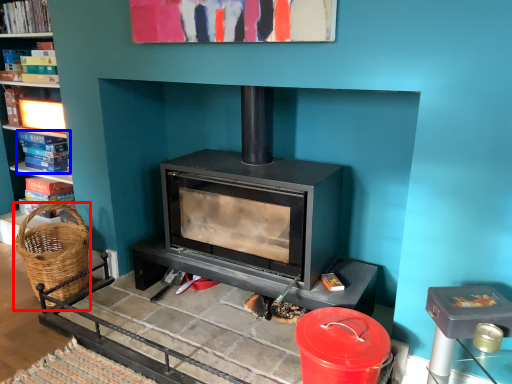
Question: Which object is further to the camera taking this photo, basket (highlighted by a red box) or book (highlighted by a blue box)?

Choices:
 (A) basket
 (B) book

Answer: (B)